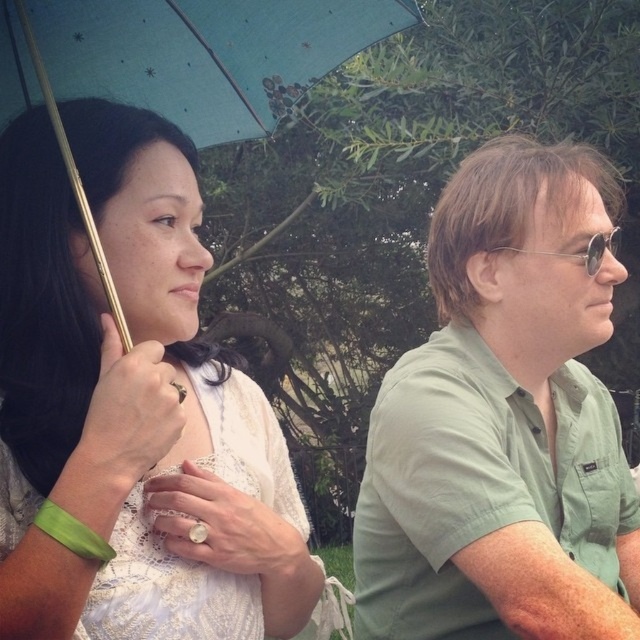
You are a photographer standing 30 inches away from the white lace dress at upper left. Can you take a clear photo of it without moving closer?

The white lace dress at upper left and viewer are 27.69 inches apart, so you are already closer than 30 inches. You can take a clear photo without moving closer.

Based on the photo, you are organizing a clothing donation drive and need to determine which item takes up more space in the donation box. Based on the scene, which item between the green cotton shirt at right and the white lace dress at upper left is larger?

The green cotton shirt at right is larger than the white lace dress at upper left, so it takes up more space in the donation box.

Based on the coordinates provided, which object corresponds to the point at (113, 337)?

The point at (113, 337) corresponds to the white lace dress at upper left.